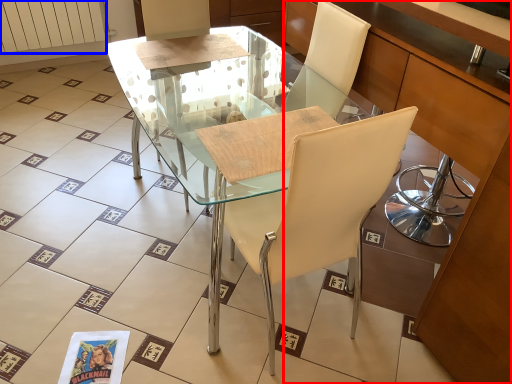
Question: Which point is closer to the camera, cabinetry (highlighted by a red box) or radiator (highlighted by a blue box)?

Choices:
 (A) cabinetry
 (B) radiator

Answer: (A)